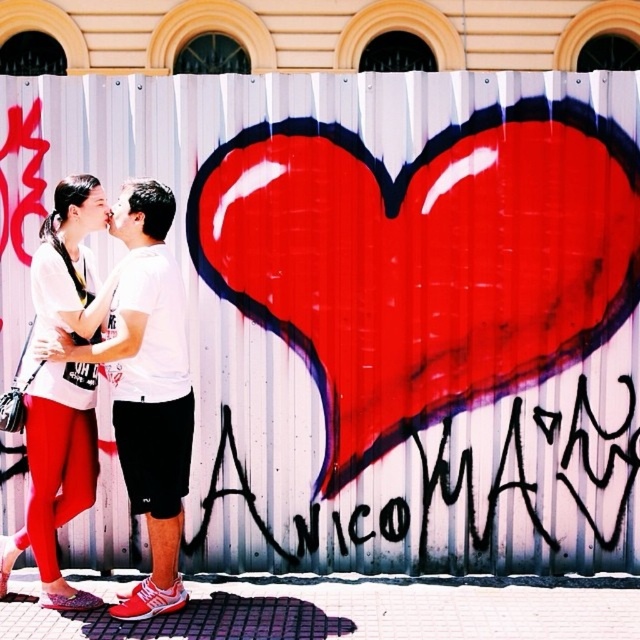
Between white matte t-shirt at center and matte white shirt at left, which one appears on the left side from the viewer's perspective?

From the viewer's perspective, matte white shirt at left appears more on the left side.

Can you confirm if white matte t-shirt at center is thinner than matte white shirt at left?

Yes.

Does point (170, 420) come in front of point (65, 406)?

Yes, point (170, 420) is closer to viewer.

At what (x,y) coordinates should I click in order to perform the action: click on white matte t-shirt at center. Please return your answer as a coordinate pair (x, y). The height and width of the screenshot is (640, 640). Looking at the image, I should click on tap(147, 388).